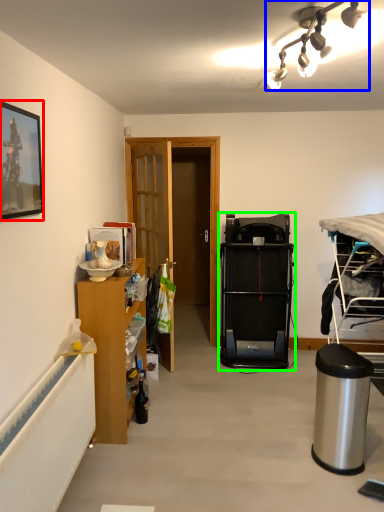
Question: Estimate the real-world distances between objects in this image. Which object is farther from picture frame (highlighted by a red box), lamp (highlighted by a blue box) or bunk bed (highlighted by a green box)?

Choices:
 (A) lamp
 (B) bunk bed

Answer: (B)